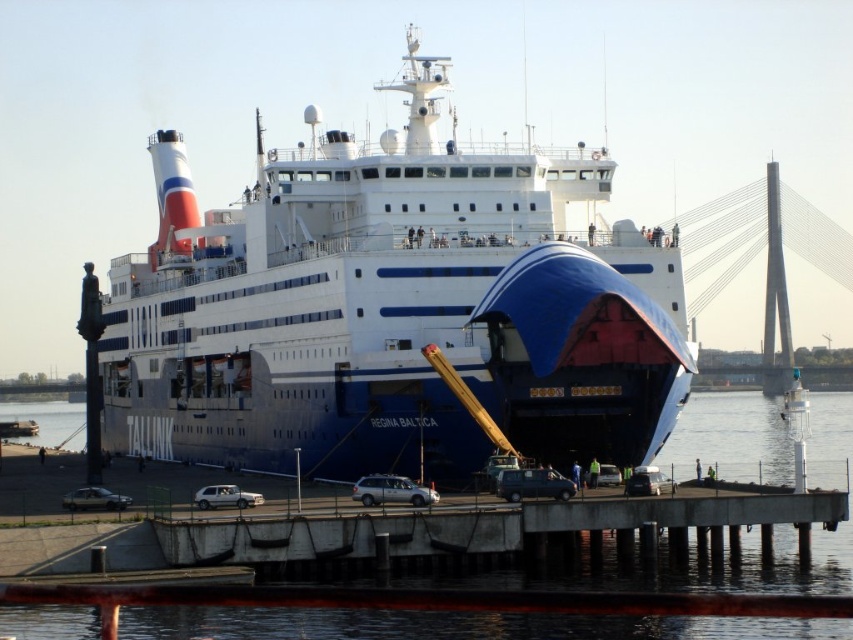
Looking at this image, you are standing on the ferry deck and see the concrete at center and the satin silver suv at center. Which object is closer to you?

The concrete at center is closer to the viewer than the satin silver suv at center.

You are a passenger on the ferry and want to board your satin silver suv at center. You are currently standing on the concrete at center. Which direction should you move to reach your vehicle?

The concrete at center is to the right of the satin silver suv at center, so you should move to the left to reach your vehicle.

You are standing on the deck of the ferry Regina Baltica and looking around. There is a point marked at coordinates (474,525). What is located at this point?

The point at coordinates (474,525) corresponds to concrete at center.